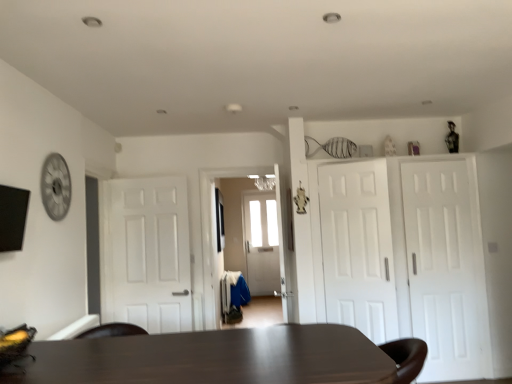
The image size is (512, 384). In order to click on vacant area on top of dark brown wooden table at center (from a real-world perspective) in this screenshot , I will do `click(249, 346)`.